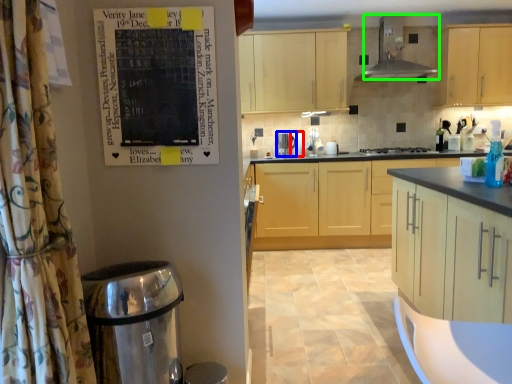
Question: Estimate the real-world distances between objects in this image. Which object is farther from appliance (highlighted by a red box), kitchen appliance (highlighted by a blue box) or home appliance (highlighted by a green box)?

Choices:
 (A) kitchen appliance
 (B) home appliance

Answer: (B)